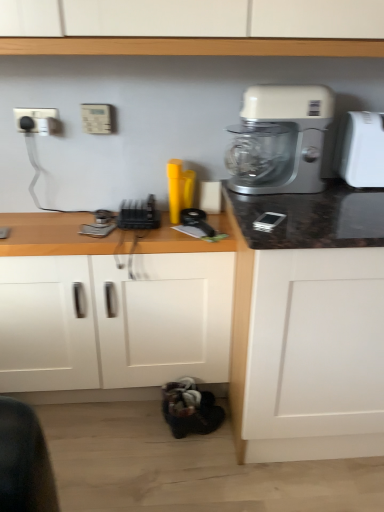
You are a GUI agent. You are given a task and a screenshot of the screen. Output one action in this format:
    pyautogui.click(x=<x>, y=<y>)
    Task: Click on the vacant space in front of black plastic toaster at center
    
    Given the screenshot: What is the action you would take?
    pyautogui.click(x=132, y=234)